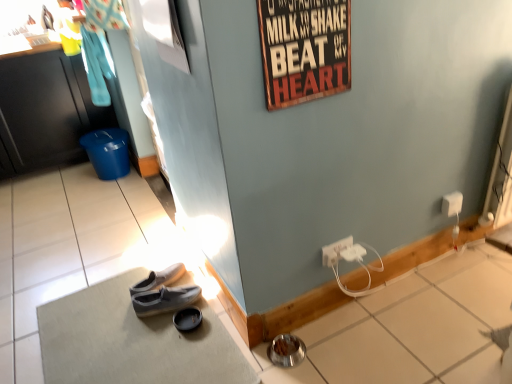
Question: Should I look upward or downward to see gray fabric doormat at lower left?

Choices:
 (A) down
 (B) up

Answer: (A)

Question: Which direction should I rotate to face gray suede shoes at lower center, which is the 1th footwear from left to right, — up or down?

Choices:
 (A) down
 (B) up

Answer: (A)

Question: Considering the relative sizes of white glossy tile at lower right and wooden signboard at upper center in the image provided, is white glossy tile at lower right bigger than wooden signboard at upper center?

Choices:
 (A) no
 (B) yes

Answer: (B)

Question: Is there a large distance between white glossy tile at lower right and wooden signboard at upper center?

Choices:
 (A) no
 (B) yes

Answer: (B)

Question: Is white glossy tile at lower right closer to the viewer compared to wooden signboard at upper center?

Choices:
 (A) no
 (B) yes

Answer: (A)

Question: From a real-world perspective, is white glossy tile at lower right located beneath wooden signboard at upper center?

Choices:
 (A) no
 (B) yes

Answer: (B)

Question: From the image's perspective, is white glossy tile at lower right beneath wooden signboard at upper center?

Choices:
 (A) yes
 (B) no

Answer: (A)

Question: From the image's perspective, is white glossy tile at lower right on wooden signboard at upper center?

Choices:
 (A) yes
 (B) no

Answer: (B)

Question: Is white plastic power outlet at lower right, the 1th power outlet in the front-to-back sequence, to the left of white glossy tile at lower right from the viewer's perspective?

Choices:
 (A) no
 (B) yes

Answer: (B)

Question: Is white plastic power outlet at lower right, which is the 3th power outlet from top to bottom, far from white glossy tile at lower right?

Choices:
 (A) yes
 (B) no

Answer: (B)

Question: Is white plastic power outlet at lower right, which is the 3th power outlet from top to bottom, closer to camera compared to white glossy tile at lower right?

Choices:
 (A) yes
 (B) no

Answer: (B)

Question: Is white plastic power outlet at lower right, which is the 3th power outlet from top to bottom, further to the viewer compared to white glossy tile at lower right?

Choices:
 (A) no
 (B) yes

Answer: (B)

Question: Is white plastic power outlet at lower right, which is the 3th power outlet in back-to-front order, at the right side of white glossy tile at lower right?

Choices:
 (A) no
 (B) yes

Answer: (A)

Question: Could you tell me if white plastic power outlet at lower right, which is the 3th power outlet from top to bottom, is facing white glossy tile at lower right?

Choices:
 (A) no
 (B) yes

Answer: (A)

Question: From a real-world perspective, is white plastic power outlet at lower right, which is the 3th power outlet in back-to-front order, over wooden signboard at upper center?

Choices:
 (A) no
 (B) yes

Answer: (A)